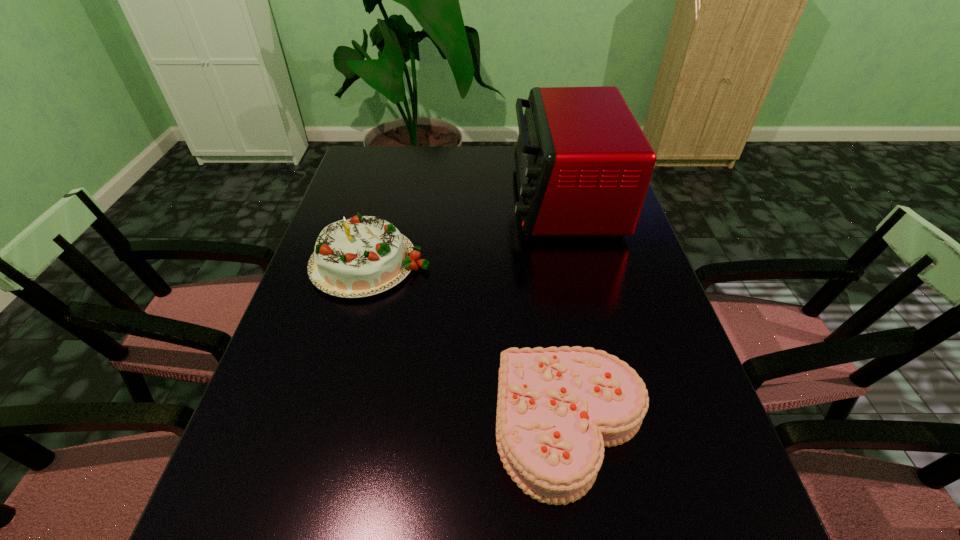
Find the location of `toaster oven`. toaster oven is located at coordinates (x=583, y=165).

You are a GUI agent. You are given a task and a screenshot of the screen. Output one action in this format:
    pyautogui.click(x=<x>, y=<y>)
    Task: Click on the leftmost object
    This screenshot has height=540, width=960.
    Given the screenshot: What is the action you would take?
    point(361,256)

You are a GUI agent. You are given a task and a screenshot of the screen. Output one action in this format:
    pyautogui.click(x=<x>, y=<y>)
    Task: Click on the left cake
    
    Given the screenshot: What is the action you would take?
    pyautogui.click(x=361, y=256)

The image size is (960, 540). Find the location of `the shortest object`. the shortest object is located at coordinates (557, 408).

Locate an element on the screen. The image size is (960, 540). the nearest object is located at coordinates (557, 408).

At what (x,y) coordinates should I click in order to perform the action: click on blank area located 0.090m on the front-facing side of the tallest object. Please return your answer as a coordinate pair (x, y). This screenshot has height=540, width=960. Looking at the image, I should click on (481, 199).

I want to click on free space located 0.100m on the front-facing side of the tallest object, so click(478, 199).

This screenshot has width=960, height=540. Find the location of `vacant position located 0.080m on the front-facing side of the tallest object`. vacant position located 0.080m on the front-facing side of the tallest object is located at coordinates (485, 199).

Locate an element on the screen. The width and height of the screenshot is (960, 540). free space located 0.390m on the back of the taller cake is located at coordinates (398, 159).

This screenshot has width=960, height=540. What are the coordinates of `free location located on the back of the shortest object` in the screenshot? It's located at (555, 325).